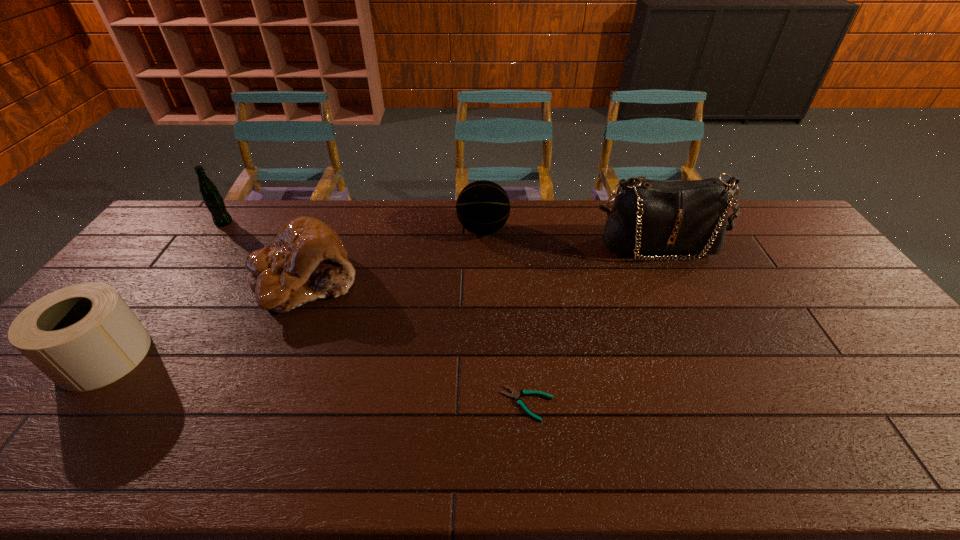
Identify the location of vacant space located on the filling side of the third object from left to right. (241, 435).

Identify the location of free location located on the front of the toilet tissue. tap(54, 422).

This screenshot has height=540, width=960. I want to click on free region located 0.090m on the left of the shortest object, so click(463, 404).

Find the location of a particular element. handbag that is positioned at the far edge is located at coordinates (648, 216).

Locate an element on the screen. This screenshot has height=540, width=960. beer bottle that is at the far edge is located at coordinates (212, 198).

Locate an element on the screen. This screenshot has height=540, width=960. basketball that is at the far edge is located at coordinates coord(483,207).

This screenshot has width=960, height=540. In order to click on object that is at the left edge in this screenshot , I will do [x=82, y=337].

Locate an element on the screen. The width and height of the screenshot is (960, 540). free spot at the far edge of the desktop is located at coordinates (734, 222).

Locate an element on the screen. The image size is (960, 540). vacant space at the near edge of the desktop is located at coordinates (772, 438).

Image resolution: width=960 pixels, height=540 pixels. Identify the location of unoccupied position between the pliers and the toilet tissue. click(x=316, y=380).